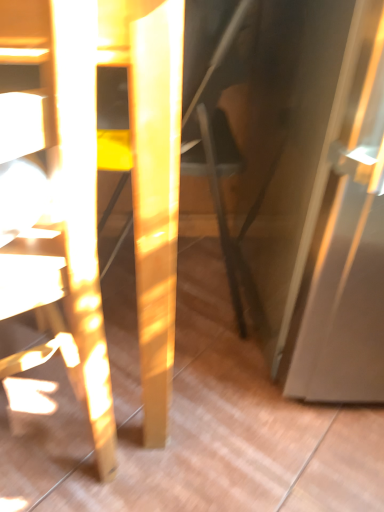
Describe the element at coordinates (212, 133) in the screenshot. I see `matte black swivel chair at center` at that location.

In order to face matte black swivel chair at center, should I rotate leftwards or rightwards?

You should rotate left by 3.468 degrees.

Locate an element on the screen. The width and height of the screenshot is (384, 512). matte black swivel chair at center is located at coordinates (212, 133).

In order to face matte yellow chair at left, should I rotate leftwards or rightwards?

To face it directly, rotate left by 23.692 degrees.

Where is `matte yellow chair at left`? Image resolution: width=384 pixels, height=512 pixels. matte yellow chair at left is located at coordinates (83, 209).

The width and height of the screenshot is (384, 512). Describe the element at coordinates (83, 209) in the screenshot. I see `matte yellow chair at left` at that location.

You are a GUI agent. You are given a task and a screenshot of the screen. Output one action in this format:
    pyautogui.click(x=<x>, y=<y>)
    Task: Click on the matte black swivel chair at center
    The width and height of the screenshot is (384, 512).
    Given the screenshot: What is the action you would take?
    (x=212, y=133)

Can you confirm if matte yellow chair at left is positioned to the left of matte black swivel chair at center?

Yes, matte yellow chair at left is to the left of matte black swivel chair at center.

Which is in front, matte yellow chair at left or matte black swivel chair at center?

matte yellow chair at left is in front.

Considering the positions of point (95, 266) and point (186, 122), is point (95, 266) closer or farther from the camera than point (186, 122)?

Point (95, 266) appears to be closer to the viewer than point (186, 122).

From the image's perspective, which one is positioned higher, matte yellow chair at left or matte black swivel chair at center?

From the image's view, matte black swivel chair at center is above.

From a real-world perspective, who is located higher, matte yellow chair at left or matte black swivel chair at center?

matte black swivel chair at center is physically above.

Can you confirm if matte yellow chair at left is wider than matte black swivel chair at center?

Correct, the width of matte yellow chair at left exceeds that of matte black swivel chair at center.

Which of these two, matte yellow chair at left or matte black swivel chair at center, stands taller?

With more height is matte yellow chair at left.

Considering the sizes of objects matte yellow chair at left and matte black swivel chair at center in the image provided, who is bigger, matte yellow chair at left or matte black swivel chair at center?

matte yellow chair at left.

Would you say matte yellow chair at left is outside matte black swivel chair at center?

Yes, matte yellow chair at left is not within matte black swivel chair at center.

Can you see matte yellow chair at left touching matte black swivel chair at center?

There is a gap between matte yellow chair at left and matte black swivel chair at center.

Is matte yellow chair at left facing towards matte black swivel chair at center?

No, matte yellow chair at left is not aimed at matte black swivel chair at center.

The height and width of the screenshot is (512, 384). I want to click on chair lying on the left of matte black swivel chair at center, so click(x=83, y=209).

Does matte black swivel chair at center appear on the right side of matte yellow chair at left?

Yes, matte black swivel chair at center is to the right of matte yellow chair at left.

Considering their positions, is matte black swivel chair at center located in front of or behind matte yellow chair at left?

Clearly, matte black swivel chair at center is behind matte yellow chair at left.

Does point (205, 143) come in front of point (85, 357)?

That is False.

From the image's perspective, which object appears higher, matte black swivel chair at center or matte yellow chair at left?

matte black swivel chair at center appears higher in the image.

From a real-world perspective, is matte black swivel chair at center below matte yellow chair at left?

Actually, matte black swivel chair at center is physically above matte yellow chair at left in the real world.

Does matte black swivel chair at center have a lesser width compared to matte yellow chair at left?

Yes, matte black swivel chair at center is thinner than matte yellow chair at left.

Considering the relative sizes of matte black swivel chair at center and matte yellow chair at left in the image provided, is matte black swivel chair at center taller than matte yellow chair at left?

No, matte black swivel chair at center is not taller than matte yellow chair at left.

Based on their sizes in the image, would you say matte black swivel chair at center is bigger or smaller than matte yellow chair at left?

matte black swivel chair at center is smaller than matte yellow chair at left.

Would you say matte black swivel chair at center contains matte yellow chair at left?

No, matte yellow chair at left is located outside of matte black swivel chair at center.

Is matte black swivel chair at center not near matte yellow chair at left?

No.

Is matte black swivel chair at center facing away from matte yellow chair at left?

matte black swivel chair at center is not turned away from matte yellow chair at left.

Measure the distance from matte black swivel chair at center to matte yellow chair at left.

15.00 inches.

Locate an element on the screen. chair below the matte black swivel chair at center (from the image's perspective) is located at coordinates (83, 209).

I want to click on swivel chair to the right of matte yellow chair at left, so click(x=212, y=133).

The height and width of the screenshot is (512, 384). I want to click on chair that appears on the left of matte black swivel chair at center, so click(x=83, y=209).